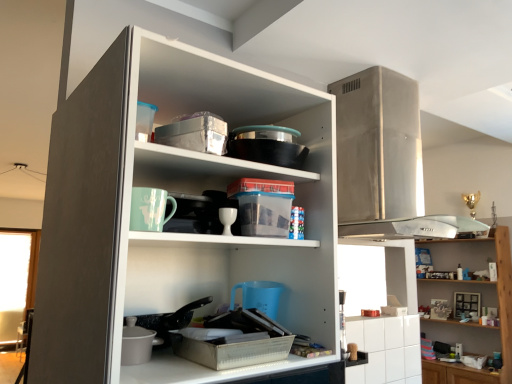
Image resolution: width=512 pixels, height=384 pixels. In order to click on vacant region above white matte cupboard at center (from a real-world perspective) in this screenshot , I will do `click(214, 89)`.